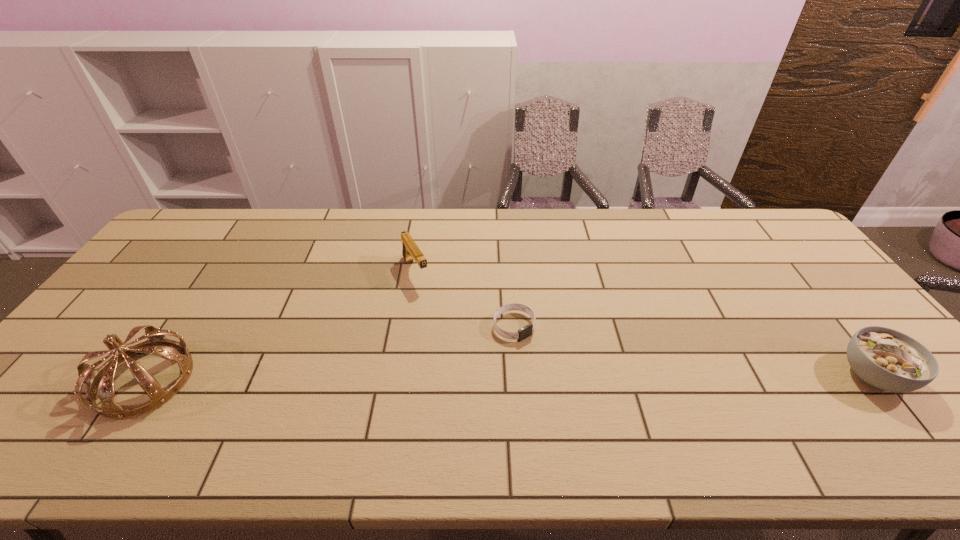
The width and height of the screenshot is (960, 540). In order to click on the tallest object in this screenshot , I will do (101, 381).

Locate an element on the screen. This screenshot has width=960, height=540. tiara is located at coordinates (101, 381).

What are the coordinates of `the rightmost object` in the screenshot? It's located at (884, 358).

This screenshot has height=540, width=960. I want to click on the farthest object, so click(410, 251).

Find the location of a particular element. pistol is located at coordinates (410, 251).

Locate an element on the screen. The width and height of the screenshot is (960, 540). the second object from right to left is located at coordinates (526, 331).

Find the location of `the shortest object`. the shortest object is located at coordinates (526, 331).

Find the location of a particular element. vacant area situated on the back of the tiara is located at coordinates (198, 301).

Identify the location of free spot located on the left of the rightmost object. (732, 375).

Where is `vacant region located 0.150m at the barrel of the pistol`? The width and height of the screenshot is (960, 540). vacant region located 0.150m at the barrel of the pistol is located at coordinates (441, 320).